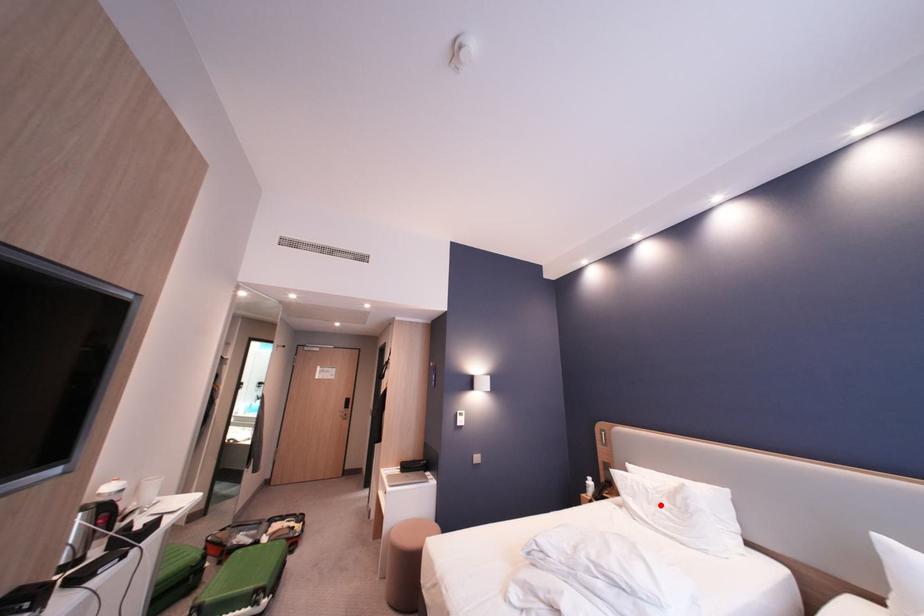
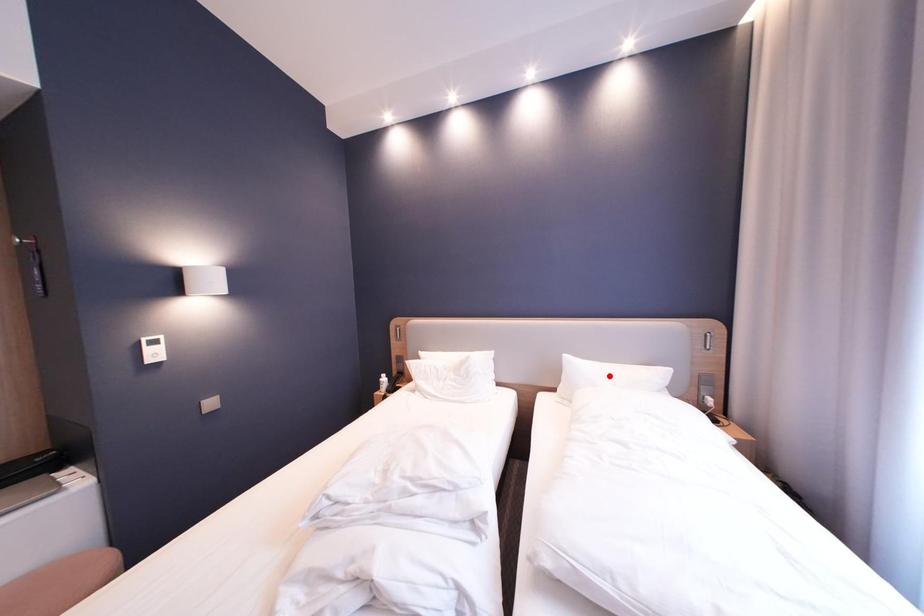
I am providing you with two images of the same scene from different viewpoints. A red point is marked on the first image and another point is marked on the second image. Is the marked point in image1 the same physical position as the marked point in image2?

No